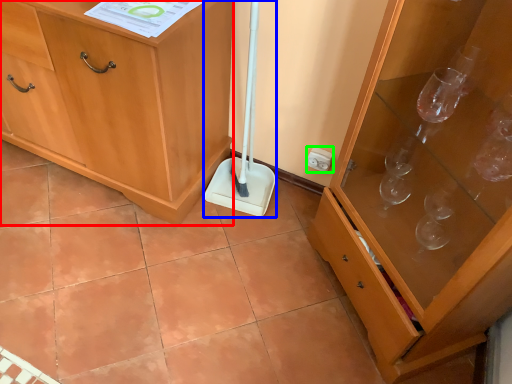
Question: Which object is positioned closest to cabinetry (highlighted by a red box)? Select from shovel (highlighted by a blue box) and electric outlet (highlighted by a green box).

Choices:
 (A) shovel
 (B) electric outlet

Answer: (A)